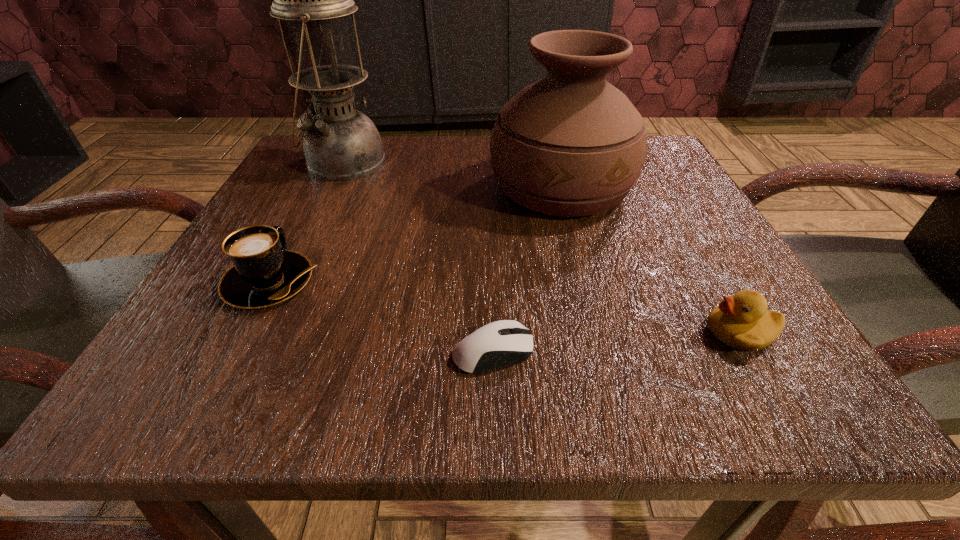
At what (x,y) coordinates should I click in order to perform the action: click on object that is at the far left corner. Please return your answer as a coordinate pair (x, y). The height and width of the screenshot is (540, 960). Looking at the image, I should click on (340, 143).

The image size is (960, 540). In order to click on object located at the far right corner in this screenshot , I will do `click(571, 144)`.

Identify the location of object that is at the near right corner. The width and height of the screenshot is (960, 540). (742, 321).

Locate an element on the screen. vacant region at the far edge of the desktop is located at coordinates (448, 170).

Locate an element on the screen. vacant area at the near edge of the desktop is located at coordinates (588, 369).

Where is `vacant space at the right edge of the desktop`? The width and height of the screenshot is (960, 540). vacant space at the right edge of the desktop is located at coordinates (627, 210).

Identify the location of free space at the far left corner. (300, 174).

This screenshot has width=960, height=540. In the image, there is a desktop. Find the location of `free region at the far right corner`. free region at the far right corner is located at coordinates (647, 181).

In the image, there is a desktop. At what (x,y) coordinates should I click in order to perform the action: click on vacant space at the near right corner. Please return your answer as a coordinate pair (x, y). Looking at the image, I should click on (683, 382).

Locate an element on the screen. The width and height of the screenshot is (960, 540). unoccupied position between the tallest object and the rightmost object is located at coordinates (541, 247).